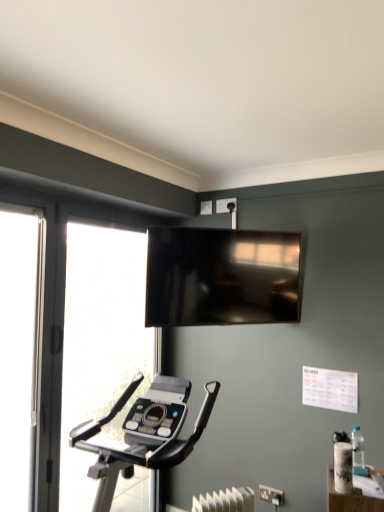
Question: From the image's perspective, is transparent glass screen door at left over transparent glass window at left?

Choices:
 (A) no
 (B) yes

Answer: (B)

Question: From a real-world perspective, is transparent glass screen door at left over transparent glass window at left?

Choices:
 (A) no
 (B) yes

Answer: (B)

Question: Is transparent glass screen door at left completely or partially outside of transparent glass window at left?

Choices:
 (A) yes
 (B) no

Answer: (A)

Question: Considering the relative sizes of transparent glass screen door at left and transparent glass window at left in the image provided, is transparent glass screen door at left smaller than transparent glass window at left?

Choices:
 (A) no
 (B) yes

Answer: (B)

Question: Considering the relative positions of transparent glass screen door at left and transparent glass window at left in the image provided, is transparent glass screen door at left to the left of transparent glass window at left from the viewer's perspective?

Choices:
 (A) no
 (B) yes

Answer: (B)

Question: Is matte black tv at upper center in front of or behind white plastic electric outlet at center, the 2th electric outlet positioned from the top, in the image?

Choices:
 (A) front
 (B) behind

Answer: (A)

Question: Would you say matte black tv at upper center is to the left or to the right of white plastic electric outlet at center, acting as the first electric outlet starting from the bottom, in the picture?

Choices:
 (A) right
 (B) left

Answer: (B)

Question: Looking at their shapes, would you say matte black tv at upper center is wider or thinner than white plastic electric outlet at center, the second electric outlet viewed from the back?

Choices:
 (A) wide
 (B) thin

Answer: (A)

Question: Based on their sizes in the image, would you say matte black tv at upper center is bigger or smaller than white plastic electric outlet at center, the 1th electric outlet from the front?

Choices:
 (A) small
 (B) big

Answer: (B)

Question: In the image, is matte black tv at upper center positioned in front of or behind transparent glass window at left?

Choices:
 (A) behind
 (B) front

Answer: (A)

Question: In terms of size, does matte black tv at upper center appear bigger or smaller than transparent glass window at left?

Choices:
 (A) big
 (B) small

Answer: (B)

Question: In terms of width, does matte black tv at upper center look wider or thinner when compared to transparent glass window at left?

Choices:
 (A) thin
 (B) wide

Answer: (A)

Question: Is matte black tv at upper center spatially inside transparent glass window at left, or outside of it?

Choices:
 (A) inside
 (B) outside

Answer: (B)

Question: In the image, is white plastic electric outlet at upper center, marked as the second electric outlet in a bottom-to-top arrangement, on the left side or the right side of transparent glass window at left?

Choices:
 (A) left
 (B) right

Answer: (B)

Question: From the image's perspective, is white plastic electric outlet at upper center, positioned as the 1th electric outlet in back-to-front order, above or below transparent glass window at left?

Choices:
 (A) above
 (B) below

Answer: (A)